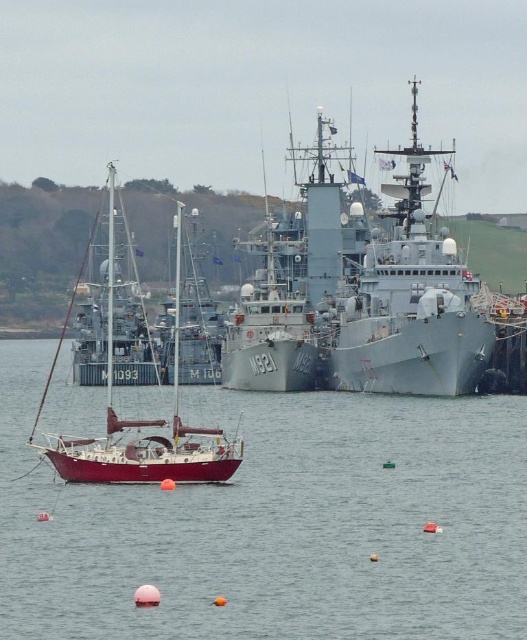
Is point (455, 452) farther from viewer compared to point (365, 252)?

No, (455, 452) is closer to viewer.

What do you see at coordinates (277, 524) in the screenshot? I see `smooth gray water at center` at bounding box center [277, 524].

Is point (183, 616) more distant than point (445, 304)?

No, it is not.

Locate an element on the screen. Image resolution: width=527 pixels, height=640 pixels. smooth gray water at center is located at coordinates coord(277,524).

Between gray metallic ship at center and shiny red sailboat at center, which one appears on the left side from the viewer's perspective?

shiny red sailboat at center is more to the left.

Who is more forward, (372,248) or (100,449)?

Positioned in front is point (100,449).

Identify the location of gray metallic ship at center. (411, 301).

Find the location of a particular element. smooth gray water at center is located at coordinates (277, 524).

Is point (28, 637) more distant than point (177, 481)?

No, (28, 637) is in front of (177, 481).

Is point (302, 420) farther from camera compared to point (65, 456)?

That is True.

Identify the location of smooth gray water at center. (277, 524).